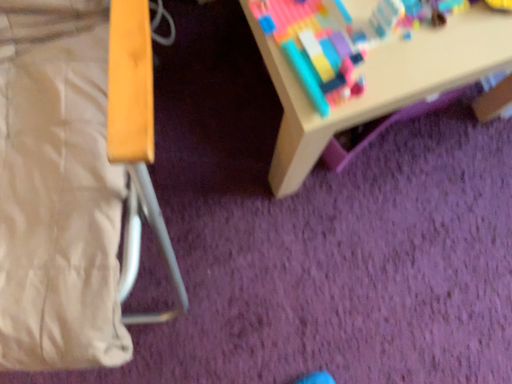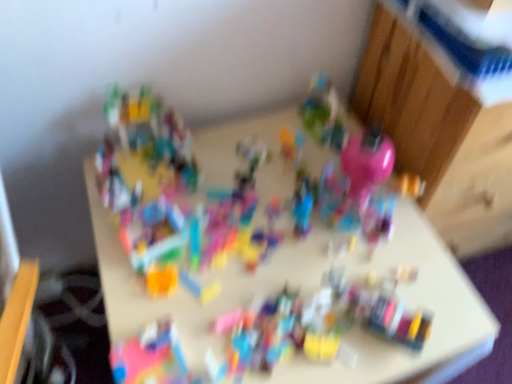
Question: How did the camera likely rotate when shooting the video?

Choices:
 (A) rotated downward
 (B) rotated upward

Answer: (B)